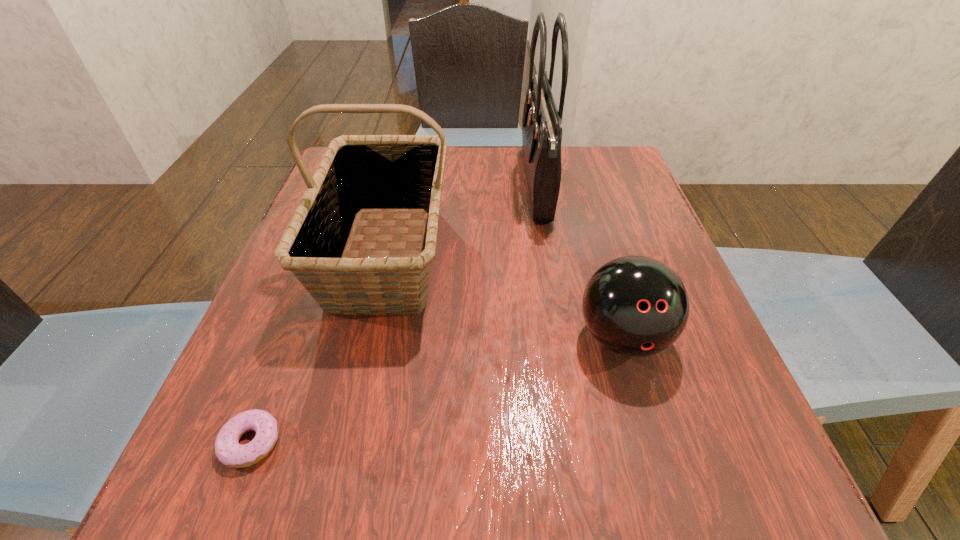
In the image, there is a desktop. What are the coordinates of `free region at the far right corner` in the screenshot? It's located at (591, 146).

Locate an element on the screen. The image size is (960, 540). free space between the second shortest object and the nearest object is located at coordinates (437, 390).

Where is `vacant area that lies between the basket and the bowling ball`? The height and width of the screenshot is (540, 960). vacant area that lies between the basket and the bowling ball is located at coordinates (505, 295).

Identify the location of vacant area between the tallest object and the bowling ball. (580, 261).

I want to click on free space between the shortest object and the third tallest object, so click(x=437, y=390).

This screenshot has height=540, width=960. I want to click on free point between the nearest object and the third tallest object, so click(437, 390).

Locate an element on the screen. empty space between the third shortest object and the handbag is located at coordinates (462, 219).

Identify the location of vacant area that lies between the tallest object and the bowling ball. (580, 261).

This screenshot has height=540, width=960. Identify the location of vacant point located between the basket and the nearest object. (319, 348).

This screenshot has width=960, height=540. What are the coordinates of `vacant space that's between the basket and the tallest object` in the screenshot? It's located at (462, 219).